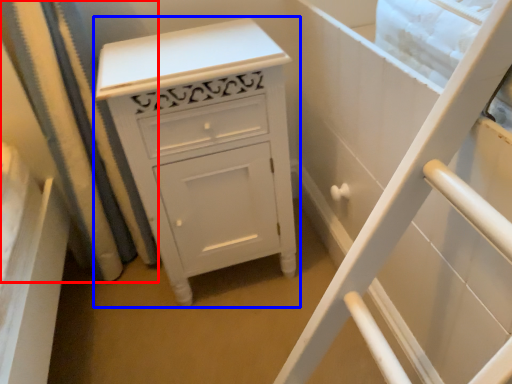
Question: Which of the following is the farthest to the observer, shower curtain (highlighted by a red box) or chest of drawers (highlighted by a blue box)?

Choices:
 (A) shower curtain
 (B) chest of drawers

Answer: (A)